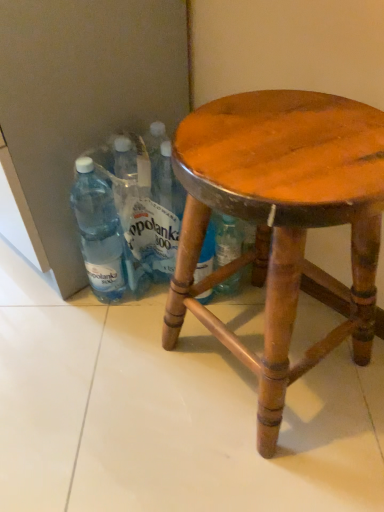
This screenshot has height=512, width=384. In order to click on vacant space in front of wooden stool at center in this screenshot , I will do `click(264, 462)`.